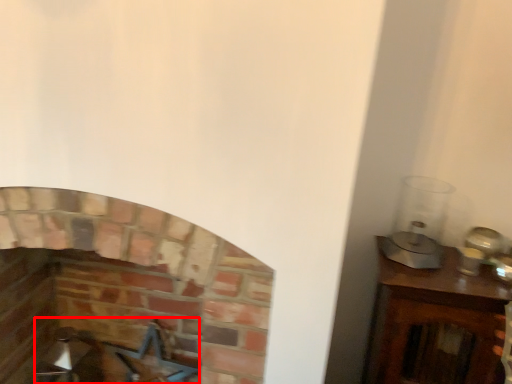
Question: In this image, where is swivel chair (annotated by the red box) located relative to fireplace?

Choices:
 (A) right
 (B) left

Answer: (A)